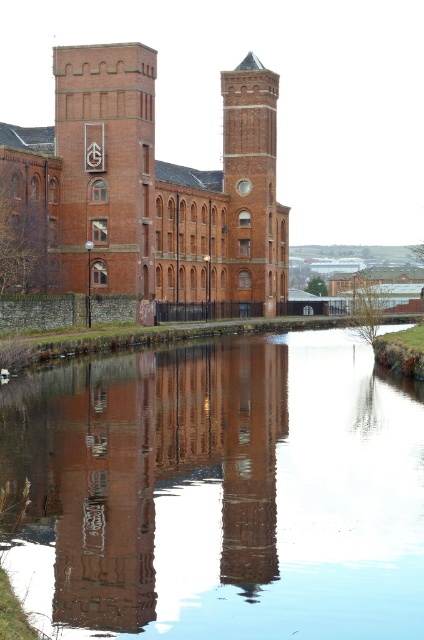
Question: Can you confirm if matte brick tower at left is thinner than brick tower at center?

Choices:
 (A) yes
 (B) no

Answer: (B)

Question: Which point appears farthest from the camera in this image?

Choices:
 (A) [237, 68]
 (B) [67, 497]
 (C) [148, 138]

Answer: (A)

Question: Which of the following is the closest to the observer?

Choices:
 (A) smooth water at center
 (B) matte brick tower at left
 (C) brick tower at center

Answer: (A)

Question: Does smooth water at center appear on the right side of matte brick tower at left?

Choices:
 (A) no
 (B) yes

Answer: (B)

Question: Can you confirm if smooth water at center is positioned below matte brick tower at left?

Choices:
 (A) yes
 (B) no

Answer: (A)

Question: Which point is closer to the camera?

Choices:
 (A) matte brick tower at left
 (B) smooth water at center
 (C) brick tower at center

Answer: (B)